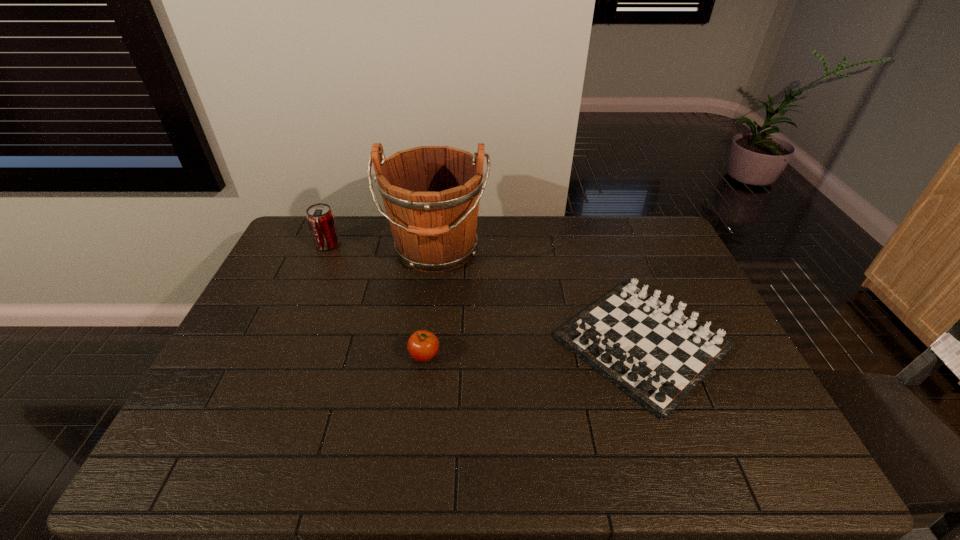
Locate an element on the screen. The image size is (960, 540). the tallest object is located at coordinates (431, 194).

This screenshot has height=540, width=960. Find the location of `pop soda`. pop soda is located at coordinates (320, 217).

Where is `the third shortest object`? Image resolution: width=960 pixels, height=540 pixels. the third shortest object is located at coordinates (320, 217).

The width and height of the screenshot is (960, 540). I want to click on the third tallest object, so click(x=423, y=345).

Find the location of a particular element. This screenshot has width=960, height=540. the shortest object is located at coordinates (656, 353).

I want to click on the rightmost object, so click(656, 353).

Locate an element on the screen. vacant point located with the handle on the side of the tallest object is located at coordinates (428, 320).

Locate an element on the screen. The image size is (960, 540). vacant region located 0.200m on the front of the leftmost object is located at coordinates click(x=308, y=291).

Find the location of `vacant region located on the right of the apple`. vacant region located on the right of the apple is located at coordinates (562, 356).

At what (x,y) coordinates should I click in order to perform the action: click on free point located 0.190m on the back of the shortest object. Please return your answer as a coordinate pair (x, y). Looking at the image, I should click on (609, 248).